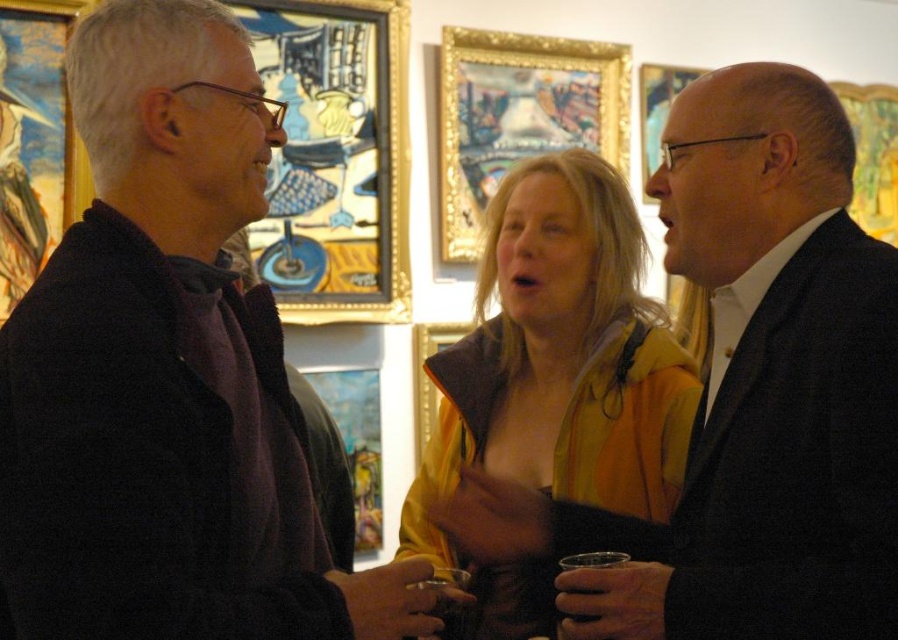
You are an event planner at the gallery and need to arrange a name tag for two guests wearing the matte black suit at center and the yellow fabric at center. Which guest should receive the larger name tag based on their clothing size?

The matte black suit at center has a larger size compared to the yellow fabric at center, so the guest wearing the matte black suit at center should receive the larger name tag.